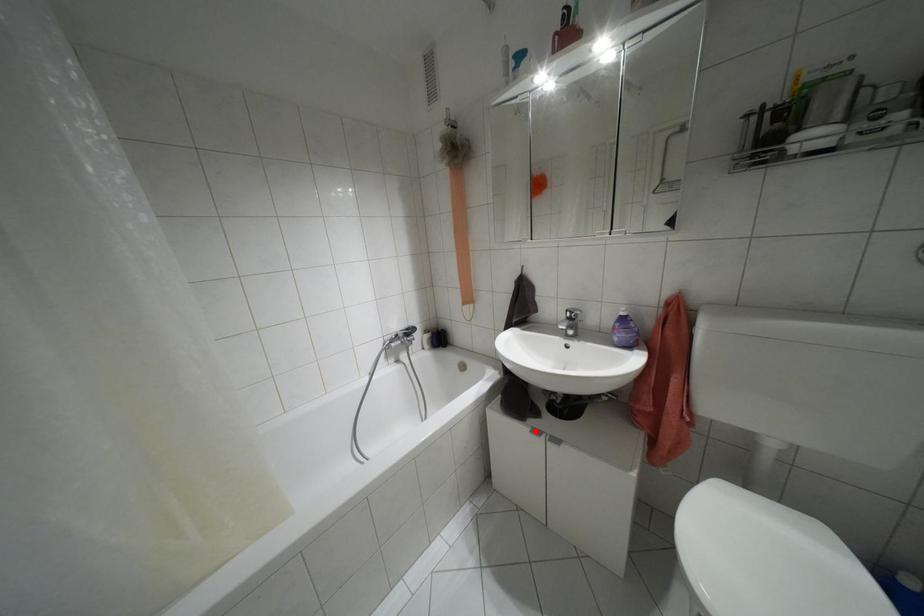
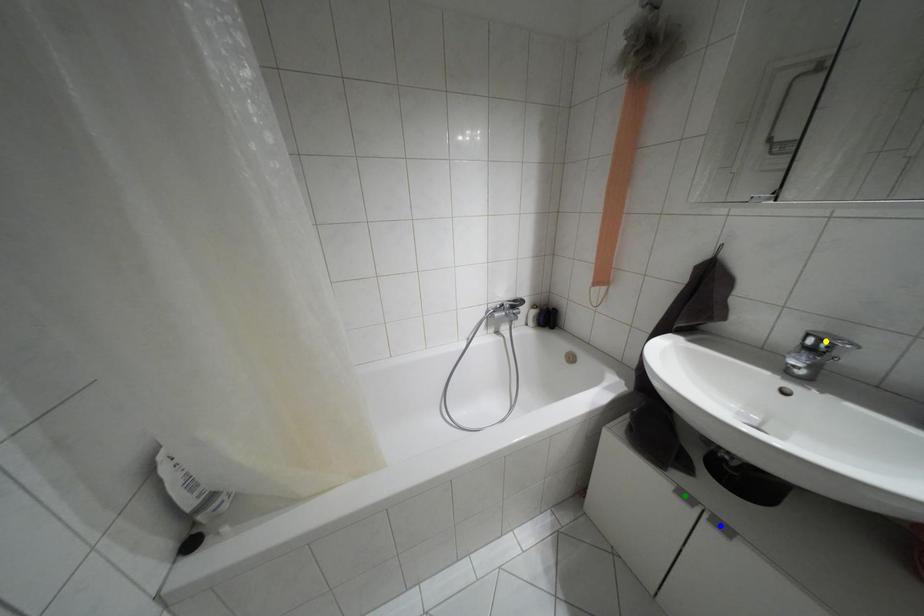
Question: I am providing you with two images of the same scene from different viewpoints. A red point is marked on the first image. You are given multiple points on the second image. Which mark in image 2 goes with the point in image 1?

Choices:
 (A) green point
 (B) blue point
 (C) yellow point

Answer: (A)